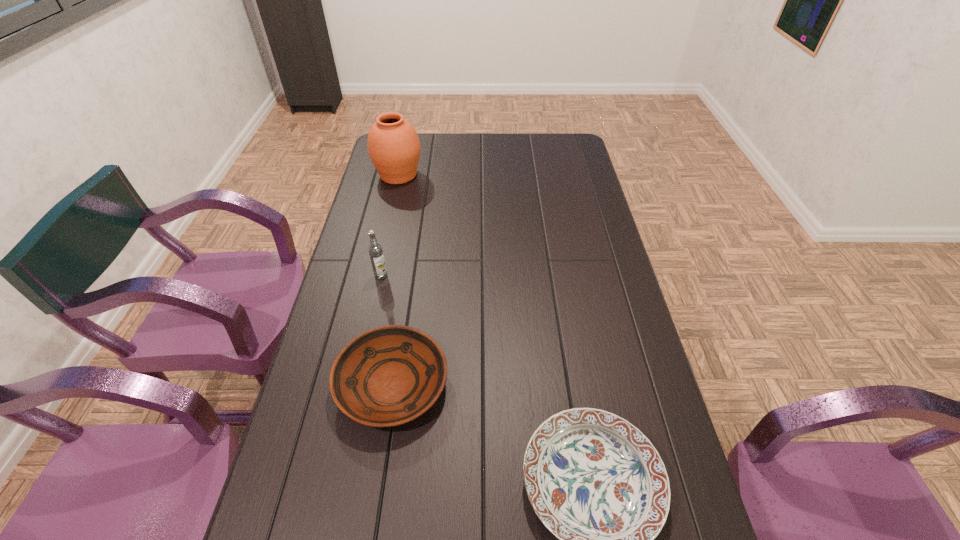
The height and width of the screenshot is (540, 960). Identify the location of urn. (393, 145).

Find the location of a particular element. The height and width of the screenshot is (540, 960). the farthest object is located at coordinates (393, 145).

Identify the location of the second farthest object. (375, 250).

At what (x,y) coordinates should I click in order to perform the action: click on vodka. Please return your answer as a coordinate pair (x, y). Looking at the image, I should click on (375, 250).

At what (x,y) coordinates should I click in order to perform the action: click on the taller plate. Please return your answer as a coordinate pair (x, y). Looking at the image, I should click on (387, 376).

Image resolution: width=960 pixels, height=540 pixels. I want to click on the left plate, so 387,376.

At what (x,y) coordinates should I click in order to perform the action: click on vacant area located on the back of the tallest object. Please return your answer as a coordinate pair (x, y). Looking at the image, I should click on (403, 154).

The image size is (960, 540). I want to click on free region located on the label of the vodka, so click(x=363, y=362).

Identify the location of vacant point located on the back of the taller plate. (415, 244).

Identify the location of object that is at the far edge. (393, 145).